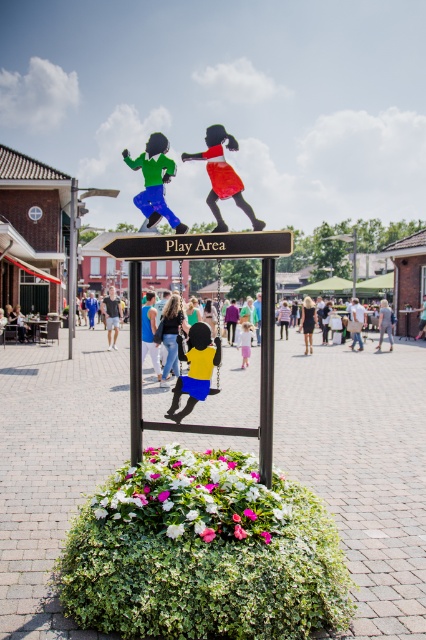
You are designing a new playground and want to ensure the signpost is visible from a distance. Given that the black wood sign at center and the brushed metal pole at center are part of the signpost, which part contributes more to visibility due to its size?

The black wood sign at center contributes more to visibility because its width is larger than the brushed metal pole at center.